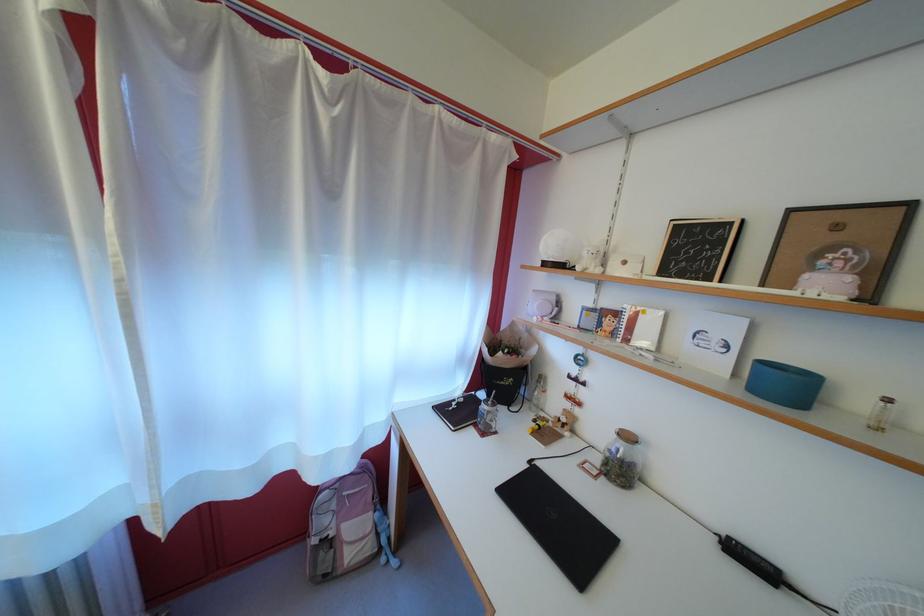
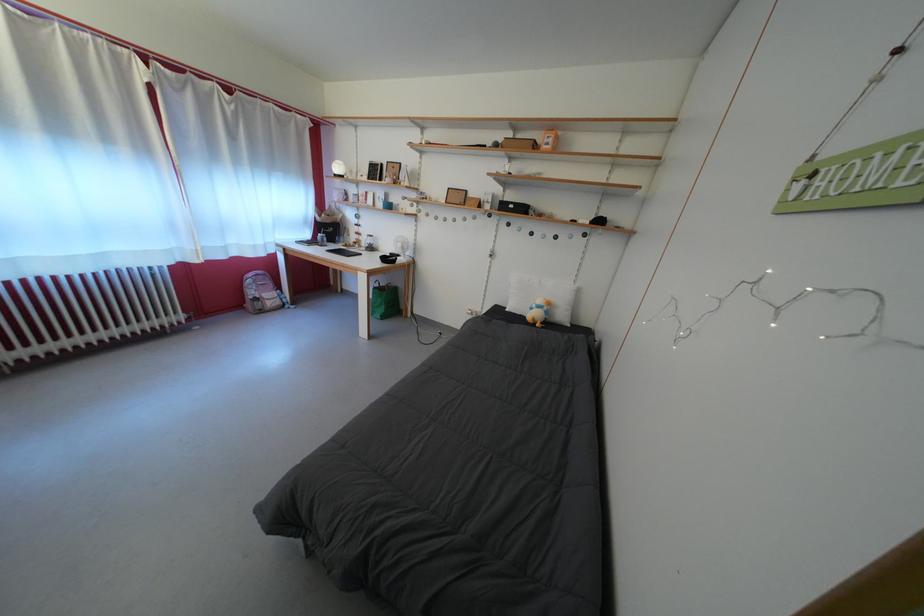
Find the pixel in the second image that matches point (331, 529) in the first image.

(261, 299)